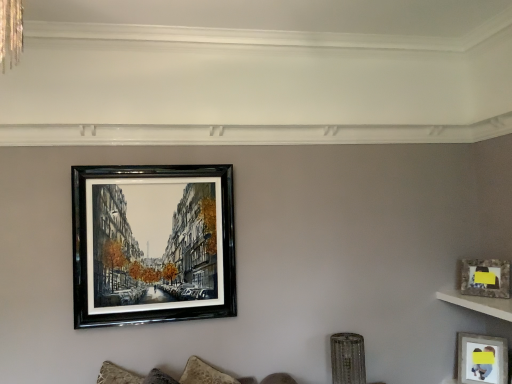
Question: Is black glossy picture frame at upper center, the first picture frame positioned from the left, thinner than matte gray picture frame at lower right, arranged as the third picture frame when viewed from the left?

Choices:
 (A) yes
 (B) no

Answer: (A)

Question: Considering the relative sizes of black glossy picture frame at upper center, the first picture frame from the top, and matte gray picture frame at lower right, arranged as the third picture frame when viewed from the left, in the image provided, is black glossy picture frame at upper center, the first picture frame from the top, smaller than matte gray picture frame at lower right, arranged as the third picture frame when viewed from the left,?

Choices:
 (A) no
 (B) yes

Answer: (A)

Question: Is black glossy picture frame at upper center, the first picture frame from the top, taller than matte gray picture frame at lower right, which ranks as the 3th picture frame in top-to-bottom order?

Choices:
 (A) yes
 (B) no

Answer: (A)

Question: From a real-world perspective, does black glossy picture frame at upper center, the 3th picture frame positioned from the bottom, stand above matte gray picture frame at lower right, arranged as the third picture frame when viewed from the left?

Choices:
 (A) yes
 (B) no

Answer: (A)

Question: Are black glossy picture frame at upper center, the first picture frame positioned from the left, and matte gray picture frame at lower right, which ranks as the 1th picture frame in bottom-to-top order, far apart?

Choices:
 (A) yes
 (B) no

Answer: (A)

Question: Is the surface of black glossy picture frame at upper center, the 3th picture frame positioned from the bottom, in direct contact with matte gray picture frame at lower right, which ranks as the 3th picture frame in top-to-bottom order?

Choices:
 (A) yes
 (B) no

Answer: (B)

Question: Considering the relative sizes of matte glass picture frame at upper right, the 2th picture frame in the left-to-right sequence, and white marble shelf at upper right in the image provided, is matte glass picture frame at upper right, the 2th picture frame in the left-to-right sequence, smaller than white marble shelf at upper right?

Choices:
 (A) yes
 (B) no

Answer: (A)

Question: Considering the relative sizes of matte glass picture frame at upper right, the 2th picture frame in the left-to-right sequence, and white marble shelf at upper right in the image provided, is matte glass picture frame at upper right, the 2th picture frame in the left-to-right sequence, thinner than white marble shelf at upper right?

Choices:
 (A) no
 (B) yes

Answer: (B)

Question: Is matte glass picture frame at upper right, placed as the 2th picture frame when sorted from right to left, looking in the opposite direction of white marble shelf at upper right?

Choices:
 (A) yes
 (B) no

Answer: (B)

Question: From the image's perspective, would you say matte glass picture frame at upper right, the 2th picture frame viewed from the top, is positioned over white marble shelf at upper right?

Choices:
 (A) yes
 (B) no

Answer: (A)

Question: Considering the relative positions of matte glass picture frame at upper right, the 2th picture frame in the left-to-right sequence, and white marble shelf at upper right in the image provided, is matte glass picture frame at upper right, the 2th picture frame in the left-to-right sequence, to the right of white marble shelf at upper right from the viewer's perspective?

Choices:
 (A) no
 (B) yes

Answer: (B)

Question: Is white marble shelf at upper right completely or partially inside matte glass picture frame at upper right, placed as the 2th picture frame when sorted from right to left?

Choices:
 (A) yes
 (B) no

Answer: (B)

Question: Can you confirm if matte gray picture frame at lower right, which ranks as the 3th picture frame in top-to-bottom order, is bigger than matte glass picture frame at upper right, the 2th picture frame in the left-to-right sequence?

Choices:
 (A) no
 (B) yes

Answer: (B)